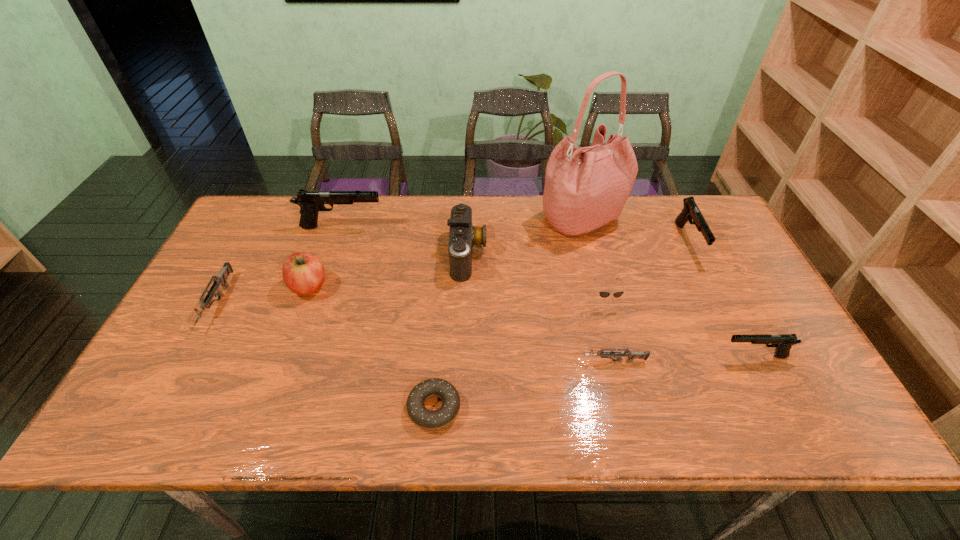
Where is `the farther grey gun`? The width and height of the screenshot is (960, 540). the farther grey gun is located at coordinates (221, 279).

At what (x,y) coordinates should I click in order to perform the action: click on the third gun from right to left. Please return your answer as a coordinate pair (x, y). This screenshot has height=540, width=960. Looking at the image, I should click on (603, 353).

You are a GUI agent. You are given a task and a screenshot of the screen. Output one action in this format:
    pyautogui.click(x=<x>, y=<y>)
    Task: Click on the second shortest object
    The height and width of the screenshot is (540, 960).
    Given the screenshot: What is the action you would take?
    pyautogui.click(x=603, y=353)

The height and width of the screenshot is (540, 960). I want to click on the shortest object, so click(x=426, y=419).

Where is `the nearest object`? The width and height of the screenshot is (960, 540). the nearest object is located at coordinates click(x=426, y=419).

The height and width of the screenshot is (540, 960). I want to click on blank area located on the right of the tallest object, so click(x=684, y=219).

Identify the location of vacant space located at the aiming end of the fourth gun from right to left. This screenshot has width=960, height=540. (455, 227).

I want to click on vacant point located on the lens of the camera, so click(565, 254).

The width and height of the screenshot is (960, 540). I want to click on free spot located 0.130m at the aiming end of the fourth shortest gun, so click(716, 299).

At what (x,y) coordinates should I click in order to perform the action: click on vacant area located 0.370m on the back of the apple. Please return your answer as a coordinate pair (x, y). This screenshot has height=540, width=960. Looking at the image, I should click on (342, 196).